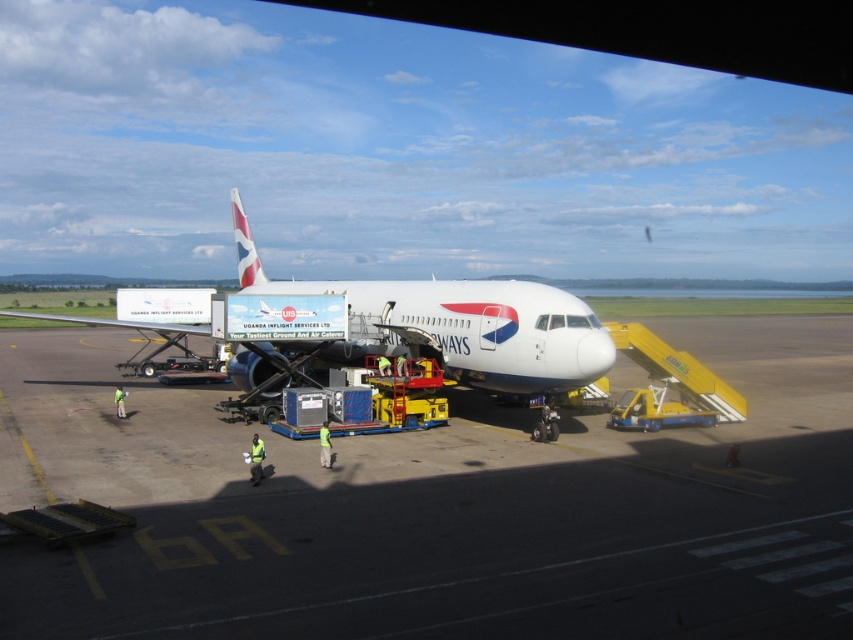
Does point (572, 561) come behind point (231, 220)?

No, (572, 561) is in front of (231, 220).

Which of these two, smooth concrete tarmac at center or white glossy airplane at center, stands taller?

Standing taller between the two is white glossy airplane at center.

Is point (77, 580) behind point (598, 369)?

No, it is in front of (598, 369).

Where is `smooth concrete tarmac at center`? The image size is (853, 640). smooth concrete tarmac at center is located at coordinates (440, 508).